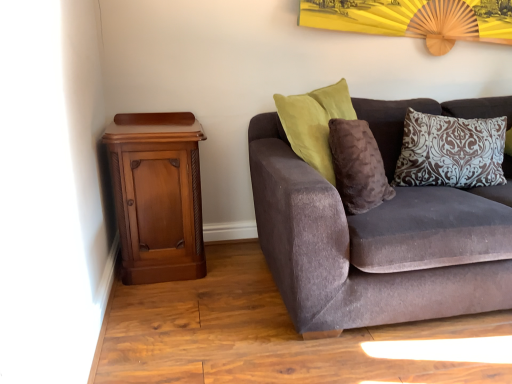
Measure the distance between point (452, 124) and camera.

A distance of 6.51 feet exists between point (452, 124) and camera.

I want to click on velvet brown couch at right, so click(376, 244).

Is brown damask pillow at upper right completely or partially inside polished wood nightstand at left?

No, brown damask pillow at upper right is located outside of polished wood nightstand at left.

Could you tell me if polished wood nightstand at left is facing brown damask pillow at upper right?

No.

At what (x,y) coordinates should I click in order to perform the action: click on nightstand on the left of brown damask pillow at upper right. Please return your answer as a coordinate pair (x, y). The image size is (512, 384). Looking at the image, I should click on (157, 195).

Looking at their sizes, would you say polished wood nightstand at left is wider or thinner than brown damask pillow at upper right?

Considering their sizes, polished wood nightstand at left looks broader than brown damask pillow at upper right.

Which of these two, brown damask pillow at upper right or polished wood nightstand at left, stands taller?

polished wood nightstand at left.

Where is `pillow located on the right of polished wood nightstand at left`? This screenshot has height=384, width=512. pillow located on the right of polished wood nightstand at left is located at coordinates (451, 151).

Considering the sizes of brown damask pillow at upper right and polished wood nightstand at left in the image, is brown damask pillow at upper right bigger or smaller than polished wood nightstand at left?

Clearly, brown damask pillow at upper right is smaller in size than polished wood nightstand at left.

Is velvet brown couch at right smaller than brown damask pillow at upper right?

Actually, velvet brown couch at right might be larger than brown damask pillow at upper right.

Which is in front, point (468, 238) or point (413, 146)?

Point (468, 238)

Identify the location of pillow that appears behind the velvet brown couch at right. This screenshot has width=512, height=384. (451, 151).

Between velvet brown couch at right and brown damask pillow at upper right, which one has less height?

With less height is brown damask pillow at upper right.

Consider the image. Considering the sizes of objects brown damask pillow at upper right and velvet brown couch at right in the image provided, who is shorter, brown damask pillow at upper right or velvet brown couch at right?

With less height is brown damask pillow at upper right.

Can you confirm if brown damask pillow at upper right is thinner than velvet brown couch at right?

Correct, the width of brown damask pillow at upper right is less than that of velvet brown couch at right.

Is brown damask pillow at upper right not near velvet brown couch at right?

They are positioned close to each other.

Is brown damask pillow at upper right not within velvet brown couch at right?

No, brown damask pillow at upper right is inside or overlapping with velvet brown couch at right.

Which of these two, velvet brown couch at right or polished wood nightstand at left, stands shorter?

polished wood nightstand at left is shorter.

How much distance is there between velvet brown couch at right and polished wood nightstand at left?

The distance of velvet brown couch at right from polished wood nightstand at left is 27.40 inches.

Is velvet brown couch at right far from polished wood nightstand at left?

No, there isn't a large distance between velvet brown couch at right and polished wood nightstand at left.

Can we say velvet brown couch at right lies outside polished wood nightstand at left?

velvet brown couch at right lies outside polished wood nightstand at left's area.

From the image's perspective, between polished wood nightstand at left and velvet brown couch at right, which one is located above?

velvet brown couch at right, from the image's perspective.

Measure the distance from polished wood nightstand at left to velvet brown couch at right.

polished wood nightstand at left is 69.61 centimeters away from velvet brown couch at right.

Which of these two, polished wood nightstand at left or velvet brown couch at right, is wider?

velvet brown couch at right is wider.

From a real-world perspective, is polished wood nightstand at left located higher than velvet brown couch at right?

No, from a real-world perspective, polished wood nightstand at left is not above velvet brown couch at right.

Locate an element on the screen. pillow behind the polished wood nightstand at left is located at coordinates 451,151.

Where is `pillow above the polished wood nightstand at left (from the image's perspective)`? Image resolution: width=512 pixels, height=384 pixels. pillow above the polished wood nightstand at left (from the image's perspective) is located at coordinates (451, 151).

Looking at the image, which one is located further to velvet brown couch at right, brown damask pillow at upper right or polished wood nightstand at left?

polished wood nightstand at left lies further to velvet brown couch at right than the other object.

From the image, which object appears to be farther from polished wood nightstand at left, velvet brown couch at right or brown damask pillow at upper right?

Based on the image, brown damask pillow at upper right appears to be further to polished wood nightstand at left.

From the image, which object appears to be nearer to polished wood nightstand at left, brown damask pillow at upper right or velvet brown couch at right?

velvet brown couch at right.

Based on the photo, looking at the image, which one is located closer to brown damask pillow at upper right, polished wood nightstand at left or velvet brown couch at right?

Based on the image, velvet brown couch at right appears to be nearer to brown damask pillow at upper right.

From the image, which object appears to be farther from brown damask pillow at upper right, velvet brown couch at right or polished wood nightstand at left?

Among the two, polished wood nightstand at left is located further to brown damask pillow at upper right.

Looking at the image, which one is located further to velvet brown couch at right, polished wood nightstand at left or brown damask pillow at upper right?

Among the two, polished wood nightstand at left is located further to velvet brown couch at right.

Find the location of a particular element. studio couch between polished wood nightstand at left and brown damask pillow at upper right in the horizontal direction is located at coordinates (376, 244).